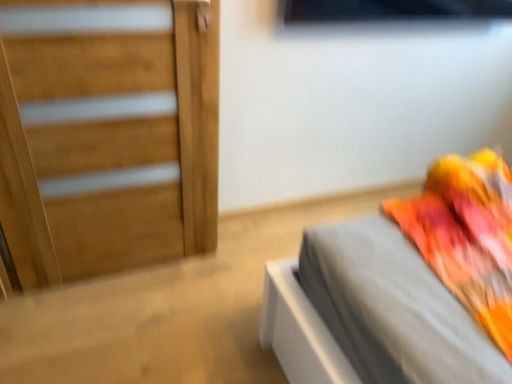
At what (x,y) coordinates should I click in order to perform the action: click on vacant space in front of wooden door at left. Please return your answer as a coordinate pair (x, y). The width and height of the screenshot is (512, 384). Looking at the image, I should click on (99, 329).